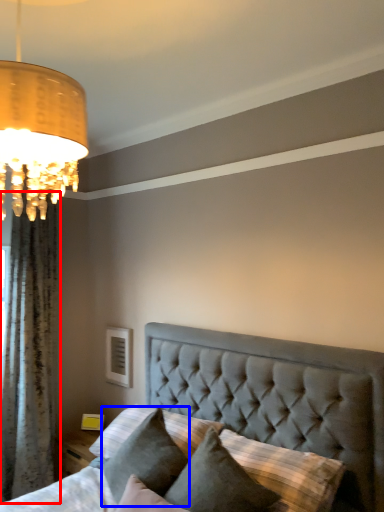
Question: Which object is further to the camera taking this photo, curtain (highlighted by a red box) or pillow (highlighted by a blue box)?

Choices:
 (A) curtain
 (B) pillow

Answer: (A)